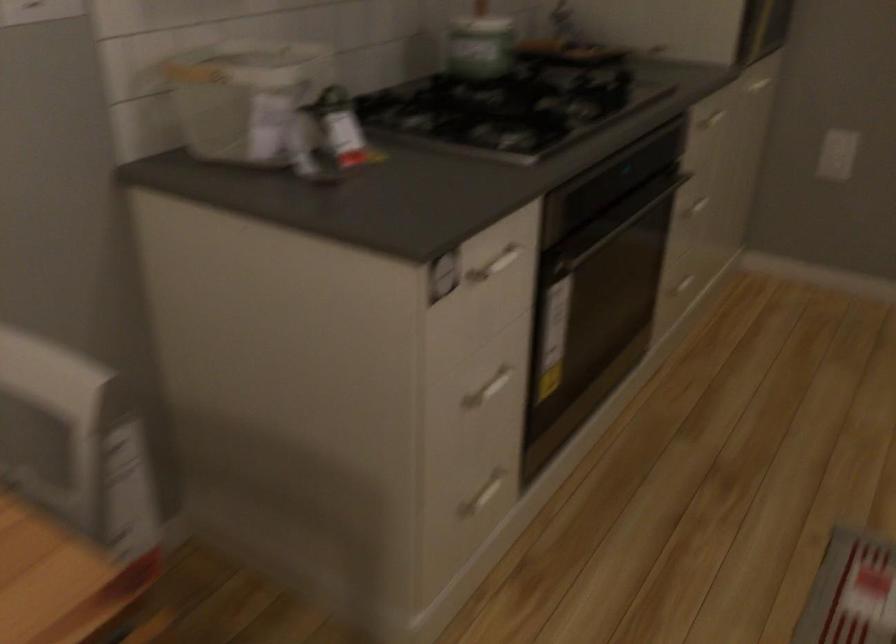
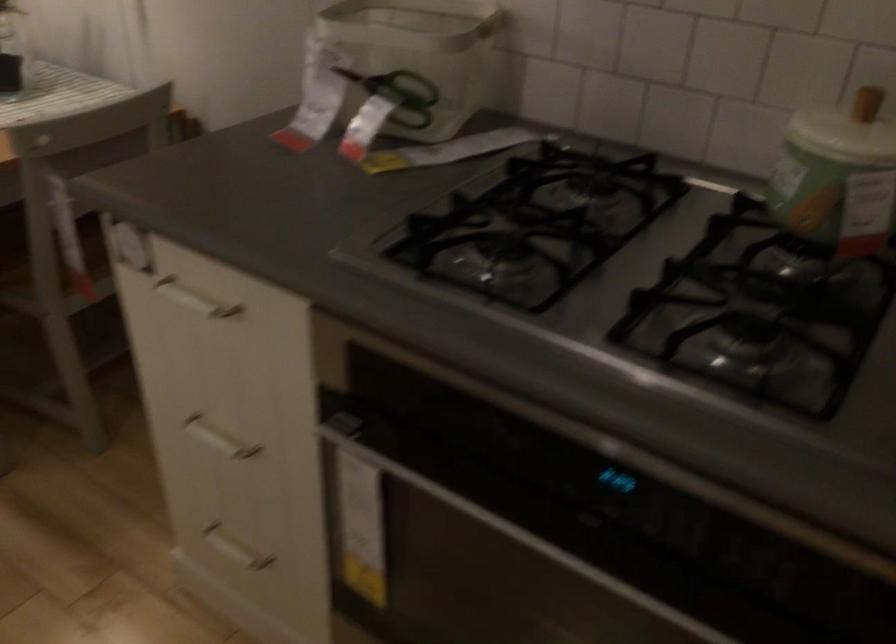
Where in the second image is the point corresponding to point (467, 415) from the first image?

(218, 438)